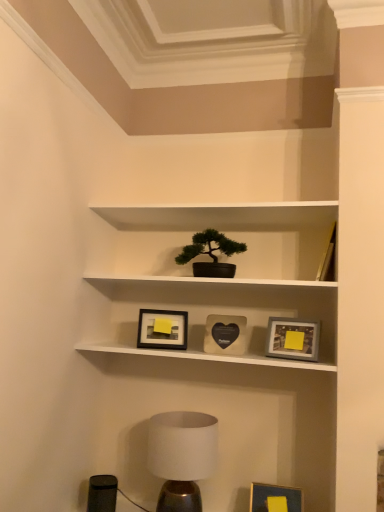
Question: Does matte gray picture frame at center right, placed as the 4th picture frame when sorted from left to right, have a greater height compared to green matte houseplant at upper center?

Choices:
 (A) yes
 (B) no

Answer: (B)

Question: Is matte gray picture frame at center right, the 3th picture frame when ordered from top to bottom, not near green matte houseplant at upper center?

Choices:
 (A) no
 (B) yes

Answer: (A)

Question: From the image's perspective, is matte gray picture frame at center right, which ranks as the 2th picture frame in bottom-to-top order, located beneath green matte houseplant at upper center?

Choices:
 (A) yes
 (B) no

Answer: (A)

Question: Is the position of matte gray picture frame at center right, the 3th picture frame when ordered from top to bottom, less distant than that of green matte houseplant at upper center?

Choices:
 (A) no
 (B) yes

Answer: (B)

Question: Is matte gray picture frame at center right, which ranks as the 2th picture frame in bottom-to-top order, surrounding green matte houseplant at upper center?

Choices:
 (A) yes
 (B) no

Answer: (B)

Question: Is point (203, 275) positioned closer to the camera than point (152, 446)?

Choices:
 (A) closer
 (B) farther

Answer: (B)

Question: Considering their positions, is green matte houseplant at upper center located in front of or behind white matte table lamp at lower center?

Choices:
 (A) behind
 (B) front

Answer: (A)

Question: From the image's perspective, relative to white matte table lamp at lower center, is green matte houseplant at upper center above or below?

Choices:
 (A) above
 (B) below

Answer: (A)

Question: Looking at their shapes, would you say green matte houseplant at upper center is wider or thinner than white matte table lamp at lower center?

Choices:
 (A) wide
 (B) thin

Answer: (B)

Question: From a real-world perspective, is green matte houseplant at upper center physically located above or below matte gray picture frame at center right, the 3th picture frame when ordered from top to bottom?

Choices:
 (A) above
 (B) below

Answer: (A)

Question: Looking at the image, does green matte houseplant at upper center seem bigger or smaller compared to matte gray picture frame at center right, the 1th picture frame positioned from the right?

Choices:
 (A) small
 (B) big

Answer: (B)

Question: From the image's perspective, is green matte houseplant at upper center above or below matte gray picture frame at center right, which ranks as the 2th picture frame in bottom-to-top order?

Choices:
 (A) above
 (B) below

Answer: (A)

Question: Is green matte houseplant at upper center taller or shorter than matte gray picture frame at center right, the 3th picture frame when ordered from top to bottom?

Choices:
 (A) short
 (B) tall

Answer: (B)

Question: Is point (269, 487) closer or farther from the camera than point (210, 348)?

Choices:
 (A) closer
 (B) farther

Answer: (A)

Question: Considering the positions of matte blue picture frame at lower right, the second picture frame viewed from the right, and matte black heart-shaped picture frame at center, which is the 4th picture frame from bottom to top, in the image, is matte blue picture frame at lower right, the second picture frame viewed from the right, wider or thinner than matte black heart-shaped picture frame at center, which is the 4th picture frame from bottom to top,?

Choices:
 (A) thin
 (B) wide

Answer: (B)